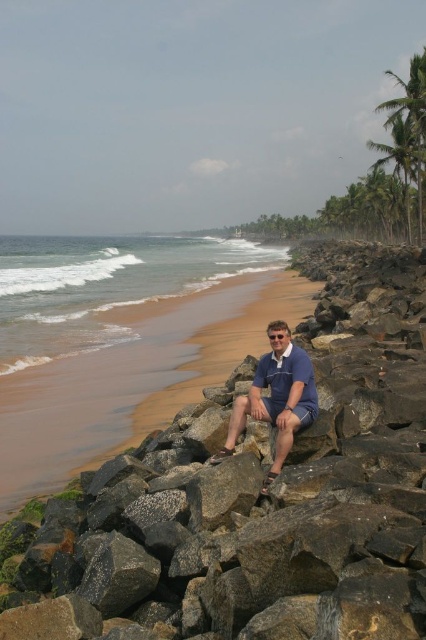
Question: Which point appears closest to the camera in this image?

Choices:
 (A) (273, 326)
 (B) (417, 170)
 (C) (336, 285)

Answer: (A)

Question: Among these objects, which one is nearest to the camera?

Choices:
 (A) green leafy palm tree at upper right
 (B) brown sand at lower left
 (C) blue cotton shirt at center
 (D) gray rough rock at center

Answer: (D)

Question: Does brown sand at lower left appear over blue cotton shirt at center?

Choices:
 (A) no
 (B) yes

Answer: (B)

Question: Does gray rough rock at center appear over blue cotton shirt at center?

Choices:
 (A) no
 (B) yes

Answer: (B)

Question: Which point appears closest to the camera in this image?

Choices:
 (A) tap(46, 392)
 (B) tap(423, 54)

Answer: (A)

Question: Is brown sand at lower left wider than blue cotton shirt at center?

Choices:
 (A) no
 (B) yes

Answer: (B)